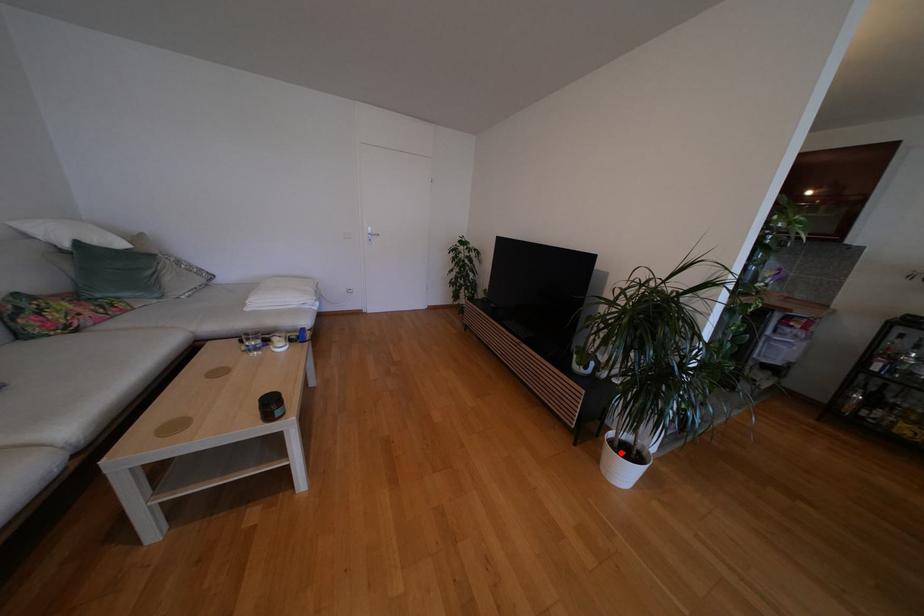
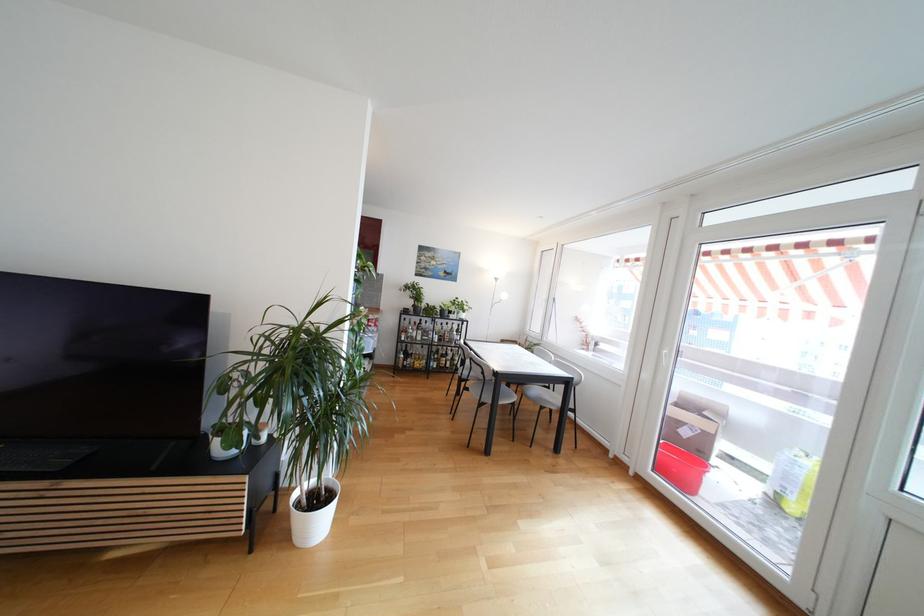
Question: I am providing you with two images of the same scene from different viewpoints. A red point is marked on the first image. Is the red point's position out of view in image 2?

Choices:
 (A) Yes
 (B) No

Answer: (B)